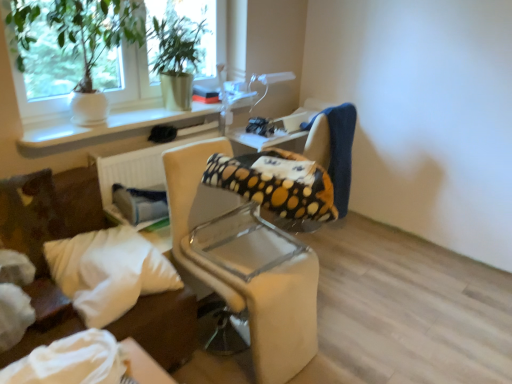
Question: From a real-world perspective, is green leafy plant in white pot at upper left, which is the second houseplant in right-to-left order, below beige fabric chair at center, the 2th chair when ordered from back to front?

Choices:
 (A) no
 (B) yes

Answer: (A)

Question: From the image's perspective, is green leafy plant in white pot at upper left, which is the second houseplant in right-to-left order, located above beige fabric chair at center, which appears as the 1th chair when viewed from the front?

Choices:
 (A) no
 (B) yes

Answer: (B)

Question: From the image's perspective, would you say green leafy plant in white pot at upper left, which is the second houseplant in right-to-left order, is shown under beige fabric chair at center, the 2th chair when ordered from back to front?

Choices:
 (A) yes
 (B) no

Answer: (B)

Question: From a real-world perspective, is green leafy plant in white pot at upper left, positioned as the 1th houseplant in left-to-right order, positioned over beige fabric chair at center, the 2th chair when ordered from back to front, based on gravity?

Choices:
 (A) yes
 (B) no

Answer: (A)

Question: Does green leafy plant in white pot at upper left, which is the second houseplant in right-to-left order, have a greater width compared to beige fabric chair at center, which appears as the 1th chair when viewed from the front?

Choices:
 (A) yes
 (B) no

Answer: (B)

Question: Is green leafy plant in white pot at upper left, positioned as the 1th houseplant in left-to-right order, not within beige fabric chair at center, which appears as the 1th chair when viewed from the front?

Choices:
 (A) no
 (B) yes

Answer: (B)

Question: Is white soft pillow at lower left further to the viewer compared to white ceramic vase at upper left?

Choices:
 (A) yes
 (B) no

Answer: (B)

Question: Considering the relative positions of white soft pillow at lower left and white ceramic vase at upper left in the image provided, is white soft pillow at lower left to the right of white ceramic vase at upper left from the viewer's perspective?

Choices:
 (A) no
 (B) yes

Answer: (A)

Question: Can you confirm if white soft pillow at lower left is wider than white ceramic vase at upper left?

Choices:
 (A) yes
 (B) no

Answer: (A)

Question: Considering the relative sizes of white soft pillow at lower left and white ceramic vase at upper left in the image provided, is white soft pillow at lower left bigger than white ceramic vase at upper left?

Choices:
 (A) no
 (B) yes

Answer: (B)

Question: From the image's perspective, is white soft pillow at lower left on white ceramic vase at upper left?

Choices:
 (A) yes
 (B) no

Answer: (B)

Question: Does white soft pillow at lower left lie in front of white ceramic vase at upper left?

Choices:
 (A) yes
 (B) no

Answer: (A)

Question: Is polka dot fabric chair at center, positioned as the 1th chair in back-to-front order, shorter than white soft pillow at lower left?

Choices:
 (A) yes
 (B) no

Answer: (B)